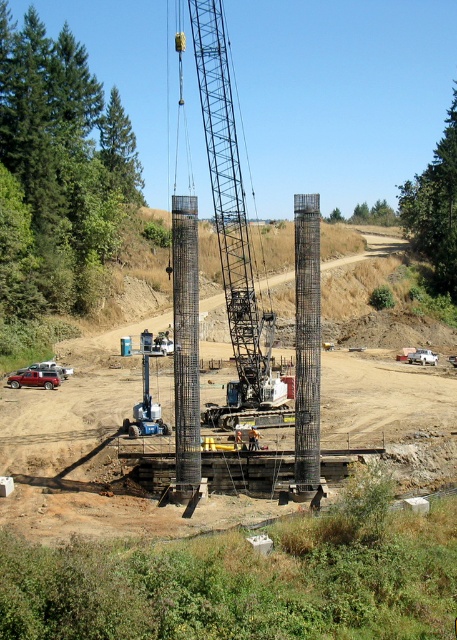
You are an inspector standing at the edge of the construction site. You need to check the alignment of the metallic grid column at center and the orange safety vest at center. According to the scene, which object is located to the right of the other?

The metallic grid column at center is positioned on the right side of orange safety vest at center, so the metallic grid column at center is to the right of the orange safety vest at center.

You are a construction worker on the construction site. You need to move a heavy load from the metallic red suv at lower left to the top of the metallic gray crane at center. Can you do this using the crane?

The metallic gray crane at center is located above the metallic red suv at lower left, so the crane cannot lift the load from the lower position of the suv to its own higher position. You would need another method to move the load to the crane.

You are an engineer inspecting the construction site. You need to ensure that the metallic gray crane at center can safely move materials around the gray metallic rebar column at center. Based on their positions, which direction should you instruct the crane operator to avoid collision with the column?

The metallic gray crane at center is positioned on the right side of the gray metallic rebar column at center. To avoid collision, the crane operator should move the crane to the left side of the column.